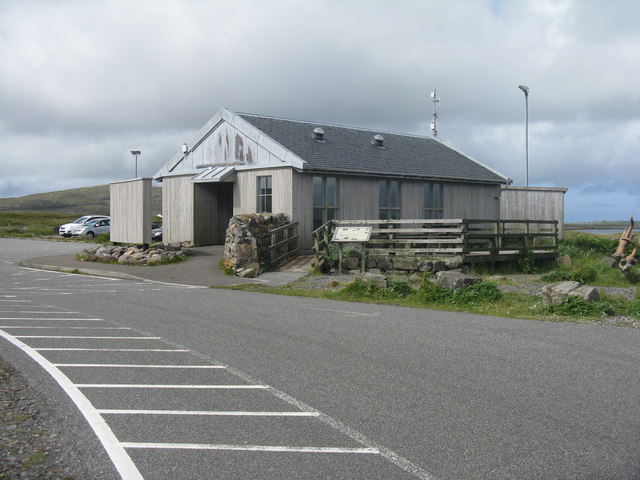
Identify the location of paint. This screenshot has height=480, width=640. (86, 387).